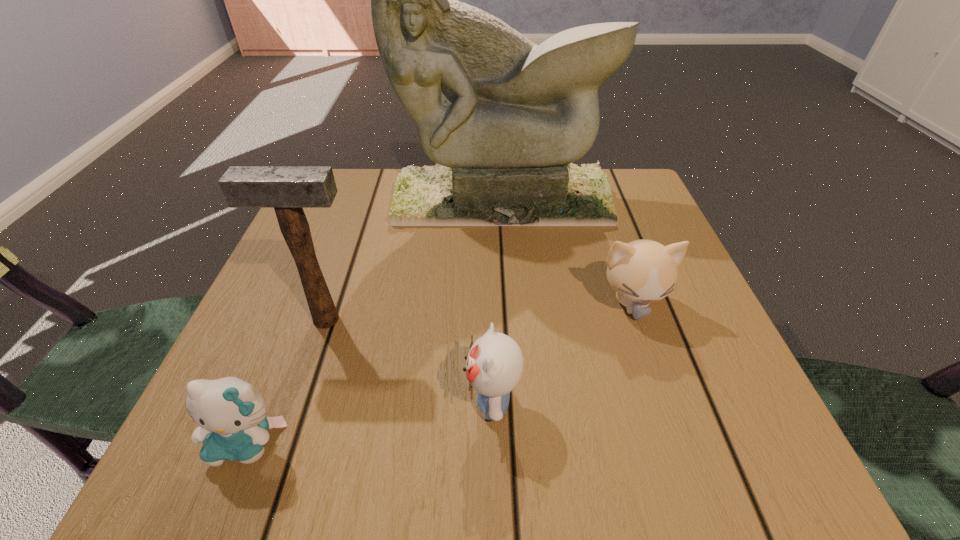
Where is `vacant region at the left edge of the desktop`? Image resolution: width=960 pixels, height=540 pixels. vacant region at the left edge of the desktop is located at coordinates (291, 304).

In the image, there is a desktop. In order to click on vacant space at the right edge in this screenshot , I will do [x=721, y=390].

The width and height of the screenshot is (960, 540). In order to click on free space at the far left corner in this screenshot , I will do `click(375, 201)`.

The width and height of the screenshot is (960, 540). Find the location of `free space at the near left corner of the desktop`. free space at the near left corner of the desktop is located at coordinates (265, 462).

Where is `vacant space at the far right corner of the desktop`? vacant space at the far right corner of the desktop is located at coordinates (652, 212).

You are a GUI agent. You are given a task and a screenshot of the screen. Output one action in this format:
    pyautogui.click(x=<x>, y=<y>)
    Task: Click on the free space at the near right corner of the desktop
    
    Given the screenshot: What is the action you would take?
    pyautogui.click(x=732, y=415)

Find the location of a particular element. This screenshot has width=960, height=540. vacant area that lies between the mallet and the rightmost kitten is located at coordinates (479, 312).

Locate an element on the screen. This screenshot has width=960, height=540. empty location between the rightmost kitten and the second kitten from right to left is located at coordinates (562, 353).

Where is `vacant region between the rightmost kitten and the second kitten from left to right`? vacant region between the rightmost kitten and the second kitten from left to right is located at coordinates (562, 353).

Locate an element on the screen. unoccupied area between the mallet and the leftmost kitten is located at coordinates (286, 381).